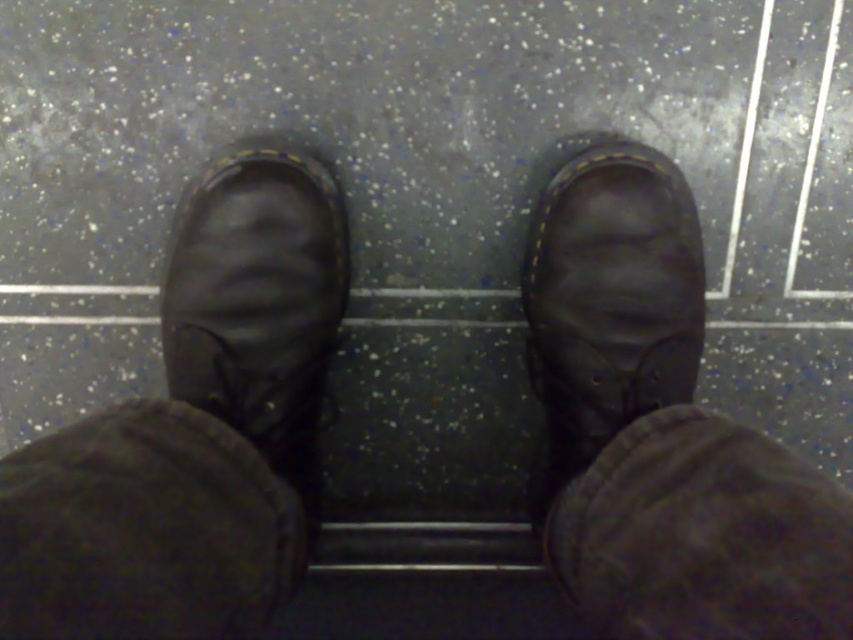
Question: Can you confirm if matte black shoe at center is smaller than matte black shoe at right?

Choices:
 (A) no
 (B) yes

Answer: (A)

Question: Which point is closer to the camera?

Choices:
 (A) (584, 218)
 (B) (288, 216)

Answer: (B)

Question: Can you confirm if matte black shoe at center is positioned to the left of matte black shoe at right?

Choices:
 (A) no
 (B) yes

Answer: (B)

Question: Which of the following is the closest to the observer?

Choices:
 (A) matte black shoe at center
 (B) matte black shoe at right

Answer: (A)

Question: Can you confirm if matte black shoe at center is smaller than matte black shoe at right?

Choices:
 (A) yes
 (B) no

Answer: (B)